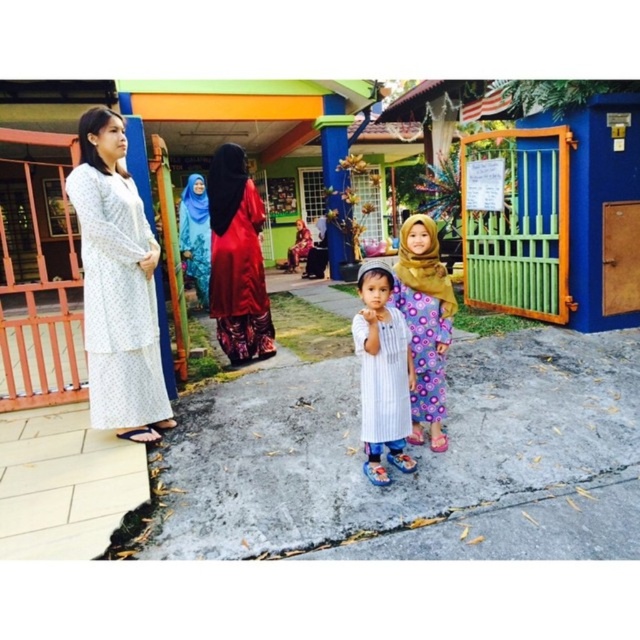
Question: Which object appears closest to the camera in this image?

Choices:
 (A) white striped shirt at center
 (B) white printed dress at left
 (C) gray concrete pavement at center
 (D) shiny red dress at center

Answer: (C)

Question: Considering the relative positions of gray concrete pavement at center and blue fabric hijab at center in the image provided, where is gray concrete pavement at center located with respect to blue fabric hijab at center?

Choices:
 (A) left
 (B) right

Answer: (B)

Question: Is shiny red dress at center to the right of white striped shirt at center from the viewer's perspective?

Choices:
 (A) yes
 (B) no

Answer: (B)

Question: Is white striped shirt at center above striped fabric dress at center?

Choices:
 (A) yes
 (B) no

Answer: (B)

Question: Which object appears closest to the camera in this image?

Choices:
 (A) striped fabric dress at center
 (B) white striped shirt at center

Answer: (B)

Question: Which object is the farthest from the white striped shirt at center?

Choices:
 (A) striped fabric dress at center
 (B) white printed dress at left

Answer: (B)